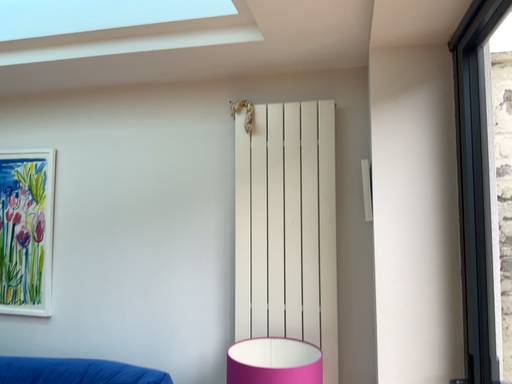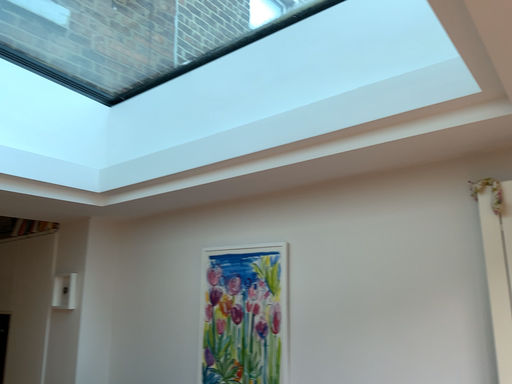
Question: Which way did the camera rotate in the video?

Choices:
 (A) rotated left
 (B) rotated right

Answer: (A)